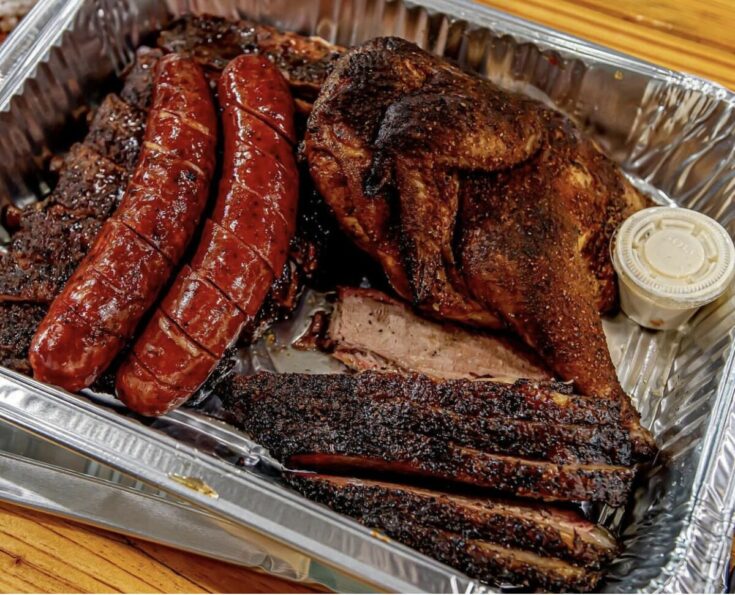
This screenshot has height=595, width=735. In order to click on large, rectangular foil pan in this screenshot , I will do `click(248, 504)`.